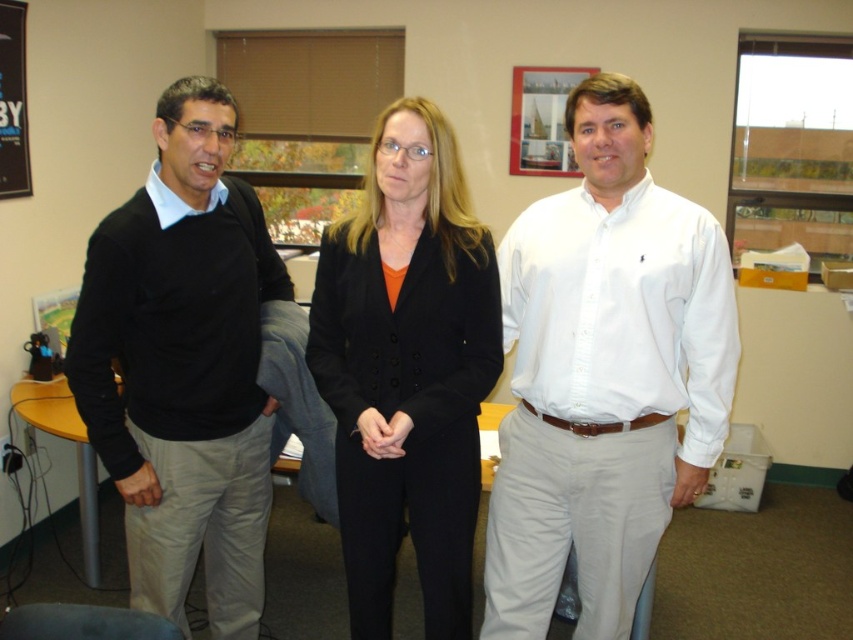
You are an office worker standing in the room. You need to determine the position of the white cotton shirt at center relative to the black wool suit at center. Which one is higher?

The white cotton shirt at center is above the black wool suit at center, so the white cotton shirt at center is higher.

You are standing in an office and see two points marked in the image. The first point is at coordinates point (705,260) and the second is at point (229,273). Which point is nearer to you?

Point (705,260) is closer to the camera than point (229,273), so the first point is nearer to you.